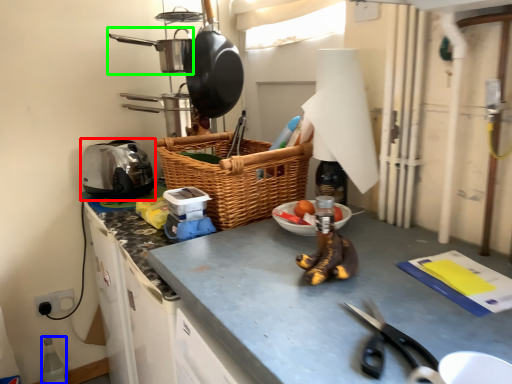
Question: Estimate the real-world distances between objects in this image. Which object is farther from appliance (highlighted by a red box), bottle (highlighted by a blue box) or frying pan (highlighted by a green box)?

Choices:
 (A) bottle
 (B) frying pan

Answer: (A)